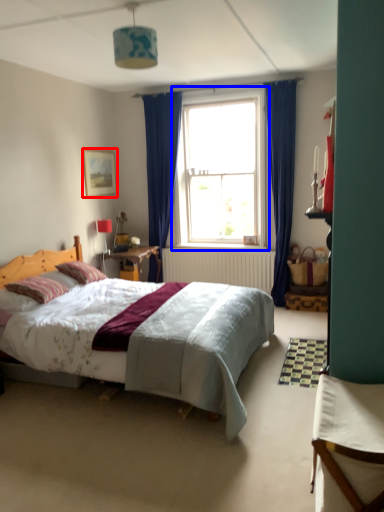
Question: Which of the following is the closest to the observer, picture frame (highlighted by a red box) or window (highlighted by a blue box)?

Choices:
 (A) picture frame
 (B) window

Answer: (B)